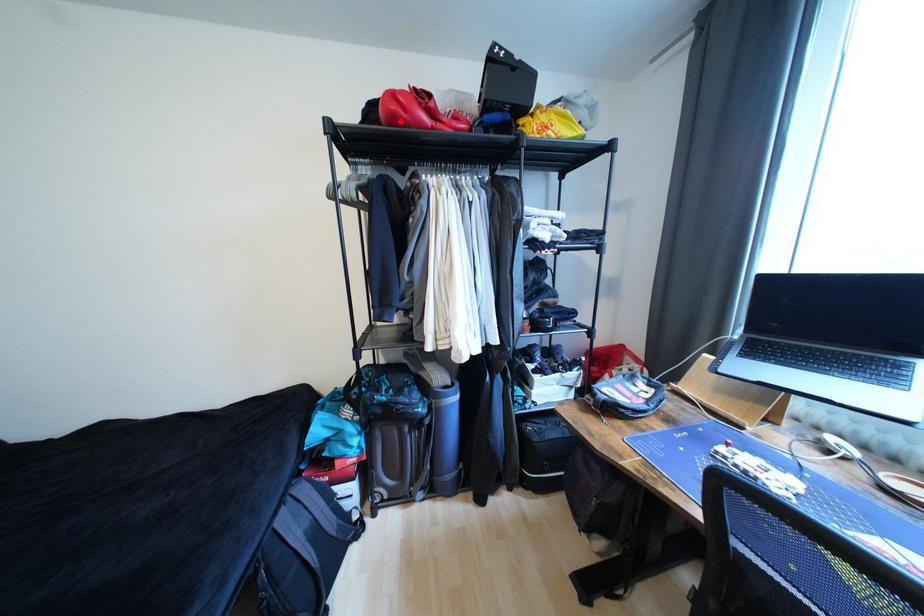
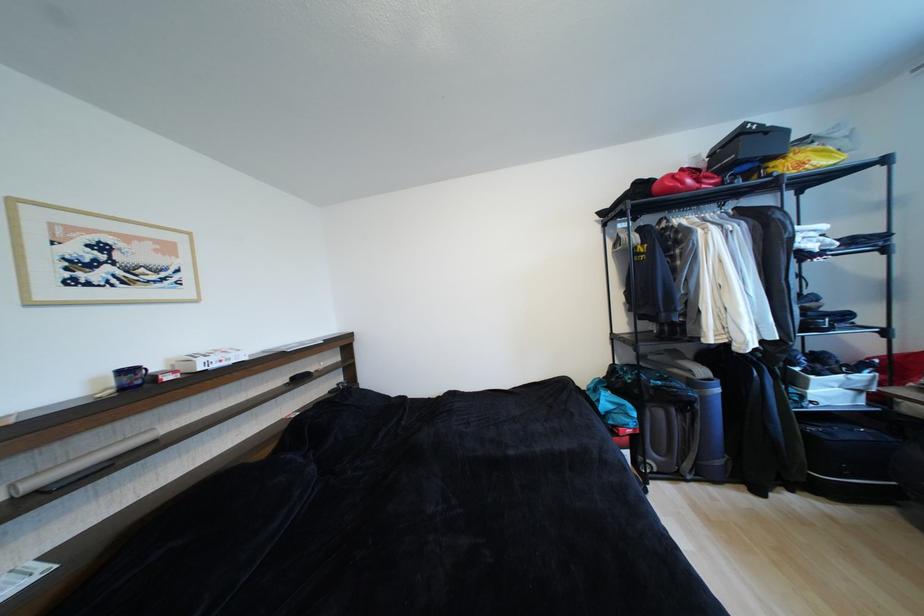
In the second image, find the point that corresponds to the highlighted location in the first image.

(676, 192)